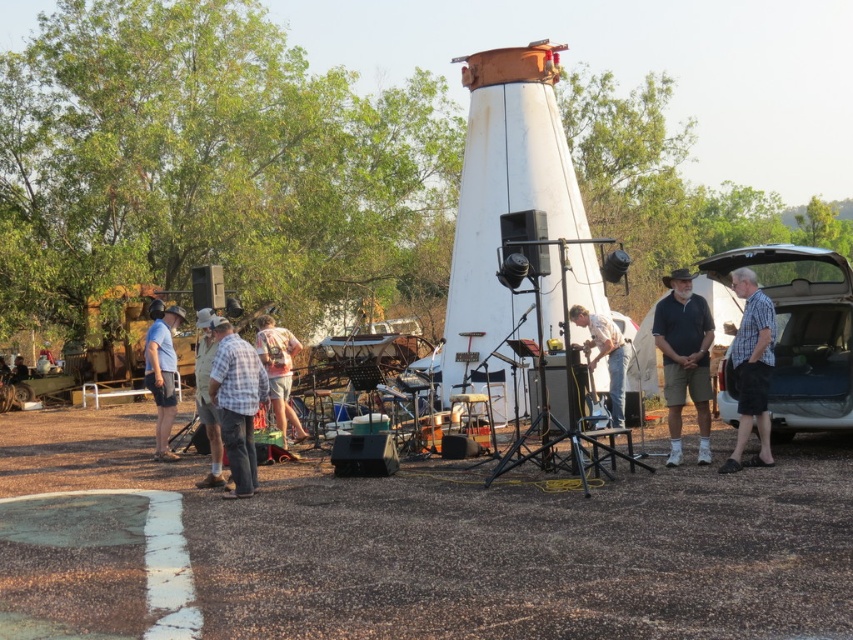
You are a photographer positioned to the left of the scene. You want to capture a clear photo of the checkered fabric shirt at right without the white matte car trunk at right blocking it. How should you adjust your position?

Move to the right so that the checkered fabric shirt at right comes into view without being blocked by the white matte car trunk at right.

You are a photographer trying to capture the scene with the matte black shirt at center and the white matte shirt at center. Which shirt is positioned lower in the image?

The matte black shirt at center is located below the white matte shirt at center, so it is positioned lower in the image.

You are a stage manager at an outdoor event. You need to ensure that two performers wearing the matte black shirt at center and the white matte shirt at center are positioned exactly 2 meters apart for a performance. Based on the current setup, are they within the required distance?

The distance between the matte black shirt at center and the white matte shirt at center is 1.89 meters, which is less than the required 2 meters. They are currently too close and need to move slightly apart to meet the distance requirement.